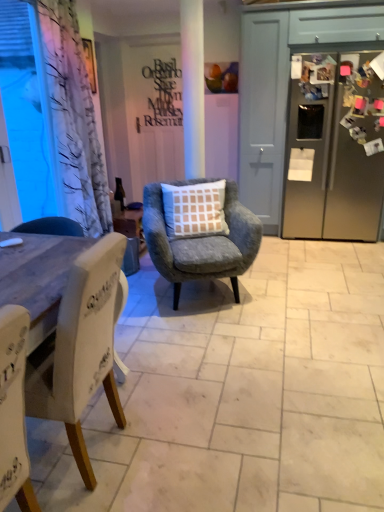
Where is `unoccupied region to the right of white fabric chair at left, which ranks as the second chair in right-to-left order`? unoccupied region to the right of white fabric chair at left, which ranks as the second chair in right-to-left order is located at coordinates coord(183,437).